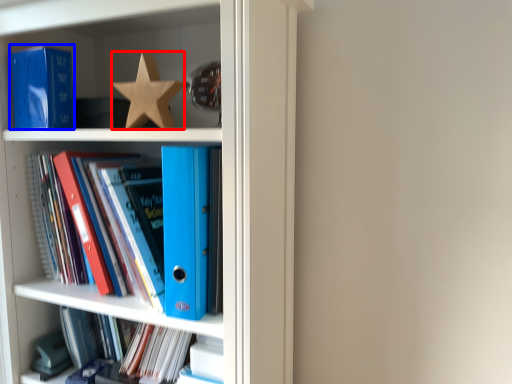
Question: Which object is closer to the camera taking this photo, star (highlighted by a red box) or paperback book (highlighted by a blue box)?

Choices:
 (A) star
 (B) paperback book

Answer: (A)